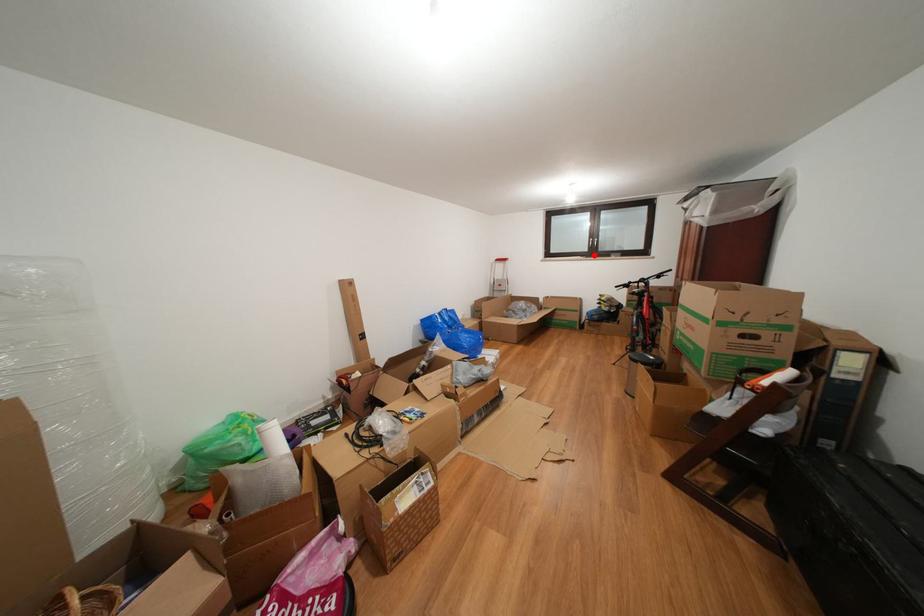
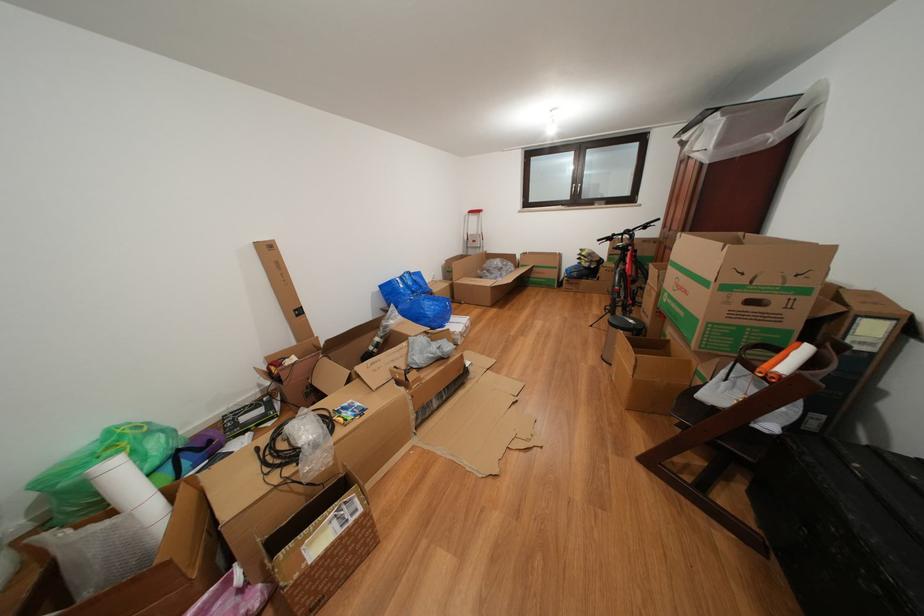
The point at the highlighted location is marked in the first image. Where is the corresponding point in the second image?

(576, 203)